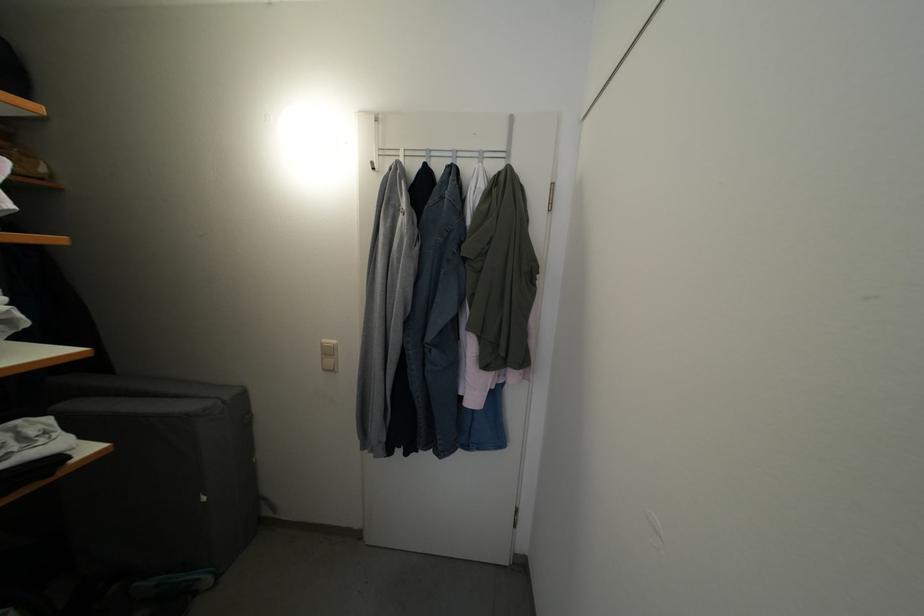
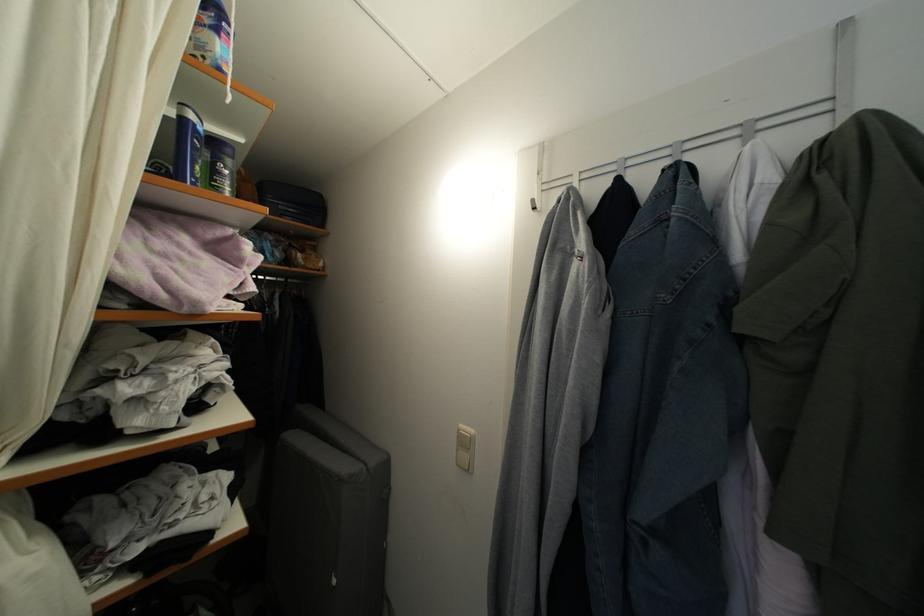
Find the pixel in the second image that matches [330,346] in the first image.

(467, 432)